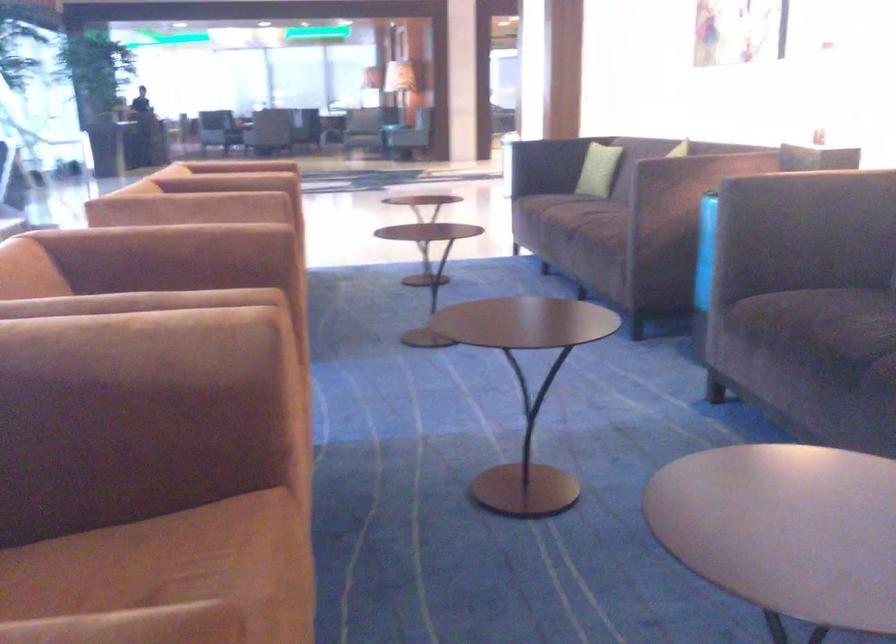
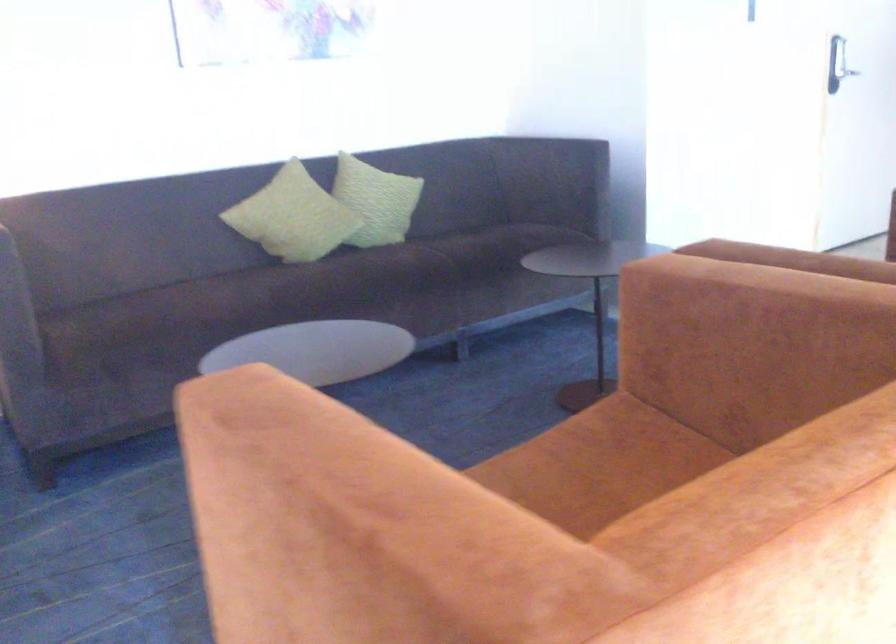
The point at (82,330) is marked in the first image. Where is the corresponding point in the second image?

(782, 267)